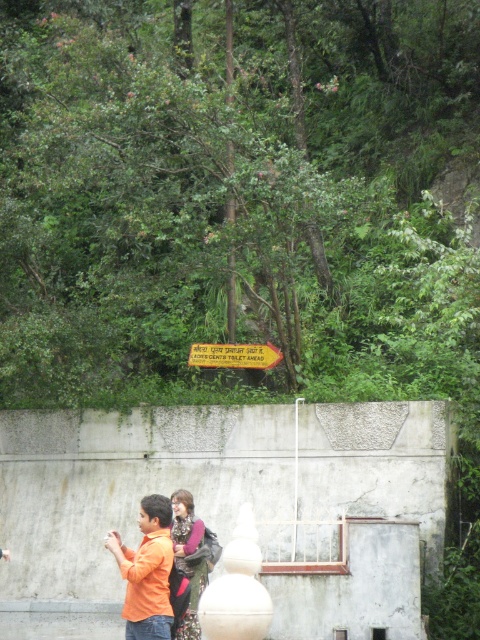
Is point (181, 552) less distant than point (237, 368)?

Yes, it is in front of point (237, 368).

Measure the distance between matte pink sweater at center and camera.

matte pink sweater at center is 13.35 meters away from camera.

The image size is (480, 640). I want to click on matte pink sweater at center, so click(x=190, y=557).

Does orange matte shirt at lower left appear under matte pink sweater at center?

No.

Image resolution: width=480 pixels, height=640 pixels. I want to click on orange matte shirt at lower left, so click(x=146, y=572).

Find the location of a particular element. The height and width of the screenshot is (640, 480). orange matte shirt at lower left is located at coordinates (146, 572).

Image resolution: width=480 pixels, height=640 pixels. I want to click on orange matte shirt at lower left, so click(x=146, y=572).

Which is in front, point (145, 582) or point (276, 358)?

Point (145, 582) is in front.

This screenshot has height=640, width=480. What do you see at coordinates (146, 572) in the screenshot?
I see `orange matte shirt at lower left` at bounding box center [146, 572].

Where is `orange matte shirt at lower left`? orange matte shirt at lower left is located at coordinates (146, 572).